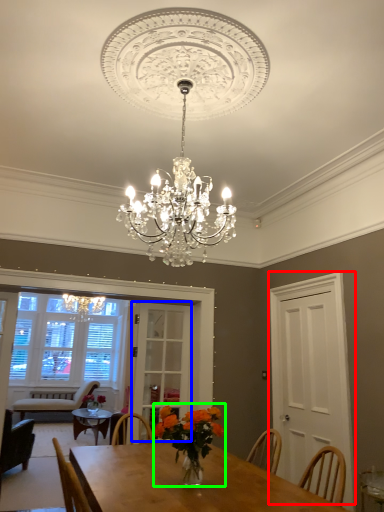
Question: Estimate the real-world distances between objects in this image. Which object is farther from glass door (highlighted by a red box), glass door (highlighted by a blue box) or floral arrangement (highlighted by a green box)?

Choices:
 (A) glass door
 (B) floral arrangement

Answer: (B)